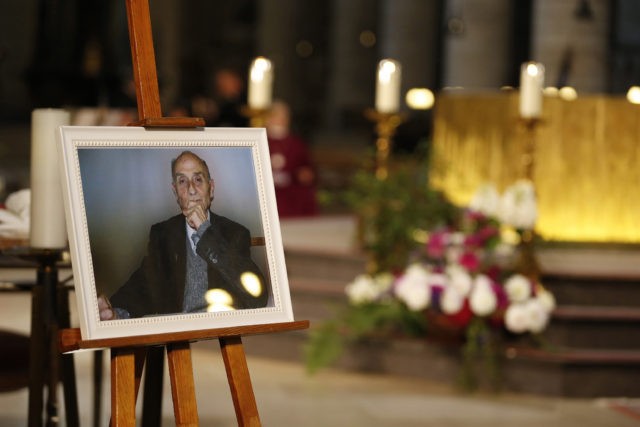
I want to click on picture frame, so click(73, 217).